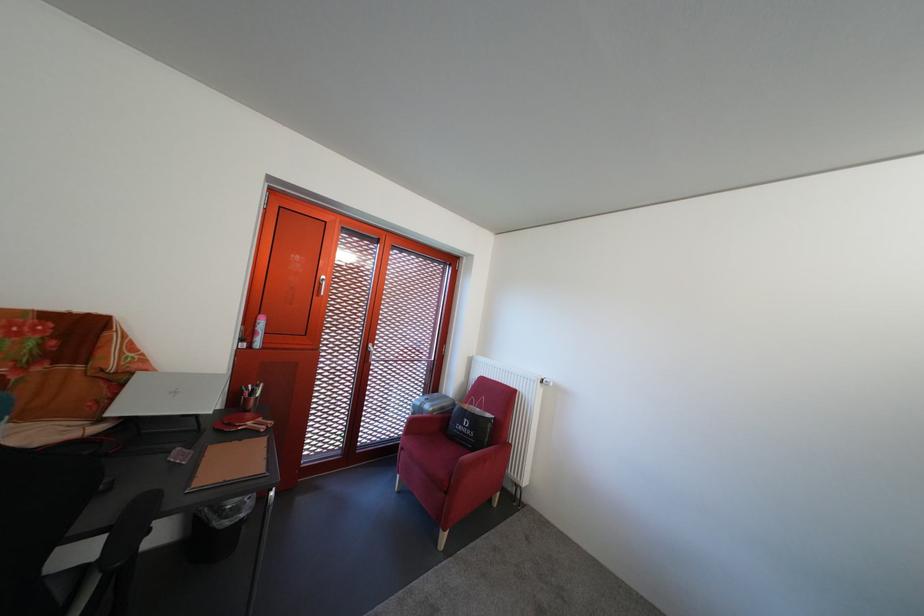
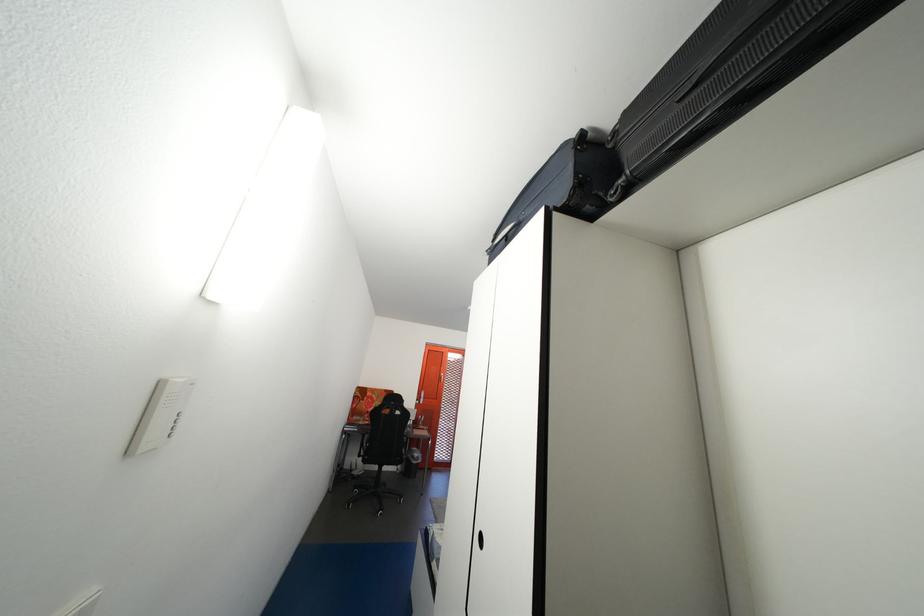
Question: I am providing you with two images of the same scene from different viewpoints. Which of the following objects are not visible in image2?

Choices:
 (A) black chair armrest
 (B) chair back top rail
 (C) red chair sitting surface
 (D) black recessed handle

Answer: (C)